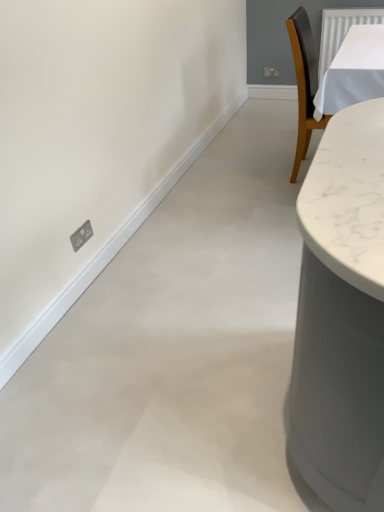
Question: Based on their sizes in the image, would you say white matte wall at left is bigger or smaller than satin silver socket at lower left?

Choices:
 (A) big
 (B) small

Answer: (A)

Question: Is white matte wall at left in front of or behind satin silver socket at lower left in the image?

Choices:
 (A) behind
 (B) front

Answer: (B)

Question: Does point (135, 229) appear closer or farther from the camera than point (79, 246)?

Choices:
 (A) farther
 (B) closer

Answer: (A)

Question: In the image, is satin silver socket at lower left positioned in front of or behind white matte wall at left?

Choices:
 (A) front
 (B) behind

Answer: (B)

Question: From a real-world perspective, is satin silver socket at lower left positioned above or below white matte wall at left?

Choices:
 (A) above
 (B) below

Answer: (A)

Question: From the image's perspective, relative to white matte wall at left, is satin silver socket at lower left above or below?

Choices:
 (A) below
 (B) above

Answer: (A)

Question: Would you say satin silver socket at lower left is inside or outside white matte wall at left?

Choices:
 (A) outside
 (B) inside

Answer: (A)